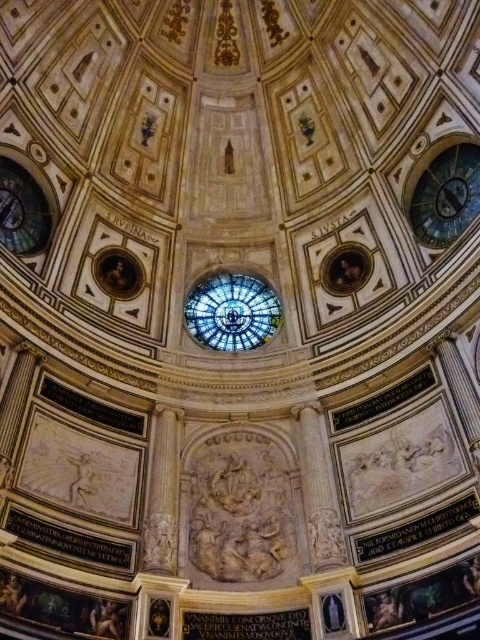
You are an architect designing a new lighting system for the grand dome. You need to install a spotlight that can reach the blue glass clock at upper right from the white marble column at center. The maximum distance the spotlight can project is 120 feet. Based on the scene description, will the spotlight be able to reach the clock?

The blue glass clock at upper right is 130.50 feet from the white marble column at center. Since the spotlight can only project up to 120 feet, it will not be able to reach the clock.

You are an architect analyzing the dome structure. You notice two points marked on the dome ceiling. The first point is at coordinate point (424,224) and the second is at point (176,433). Which of these points is closer to the camera observing the dome from below?

Point (424,224) is further to the camera than point (176,433), so the point closer to the camera is point (176,433).